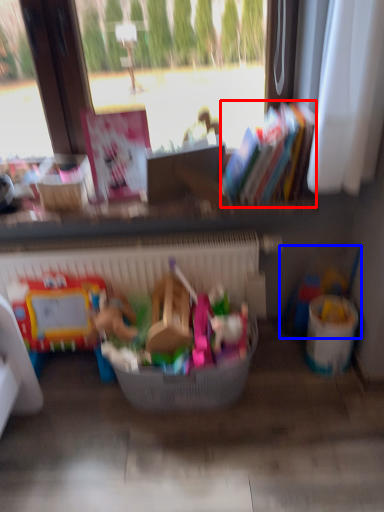
Question: Which object is closer to the camera taking this photo, book (highlighted by a red box) or toy (highlighted by a blue box)?

Choices:
 (A) book
 (B) toy

Answer: (A)